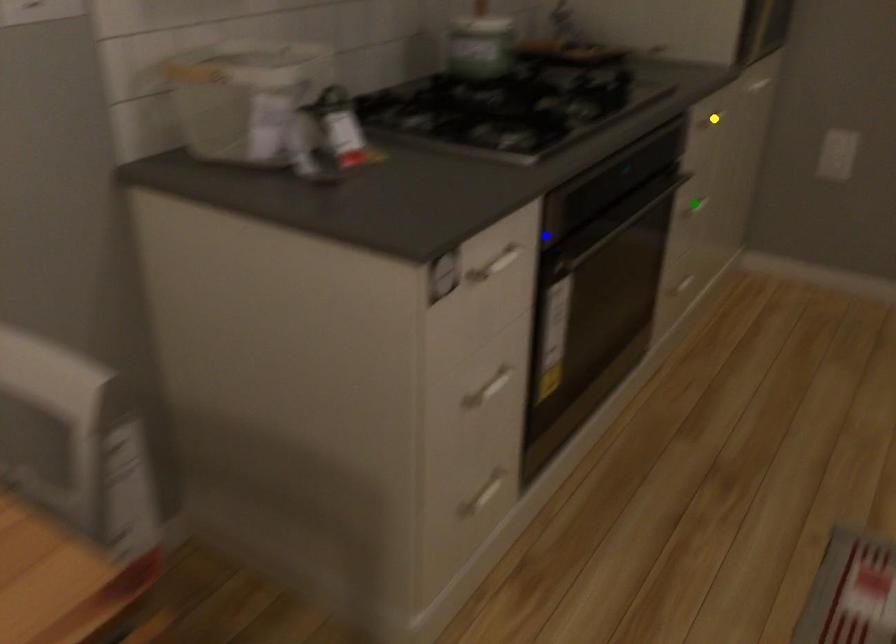
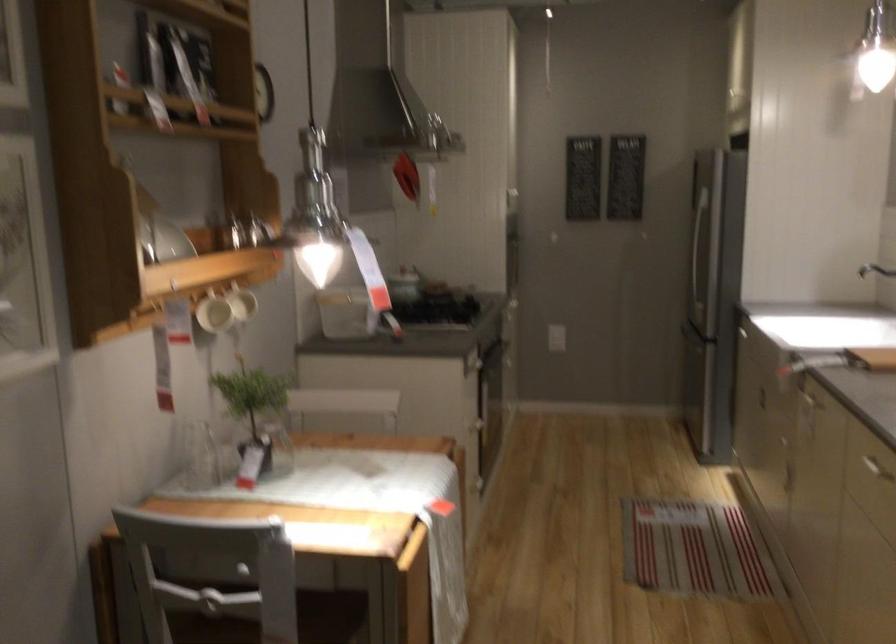
I am providing you with two images of the same scene from different viewpoints. Three points are marked in image1. Which point corresponds to a part or object that is occluded in image2?In image1, three points are marked. Which of them correspond to a part or object that is occluded in image2?Among the three points shown in image1, which one corresponds to a part or object that is no longer visible due to occlusion in image2?

yellow point, green point cannot be seen in image2.